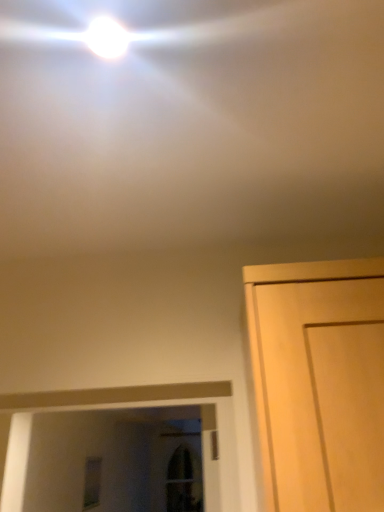
Question: Visually, is white glossy droplight at upper center positioned to the left or to the right of light wood door at right?

Choices:
 (A) left
 (B) right

Answer: (A)

Question: From the image's perspective, is white glossy droplight at upper center positioned above or below light wood door at right?

Choices:
 (A) below
 (B) above

Answer: (B)

Question: Which object is the closest to the light wood door at right?

Choices:
 (A) clear glass window at lower left
 (B) white glossy droplight at upper center

Answer: (B)

Question: Estimate the real-world distances between objects in this image. Which object is closer to the white glossy droplight at upper center?

Choices:
 (A) light wood door at right
 (B) clear glass window at lower left

Answer: (A)